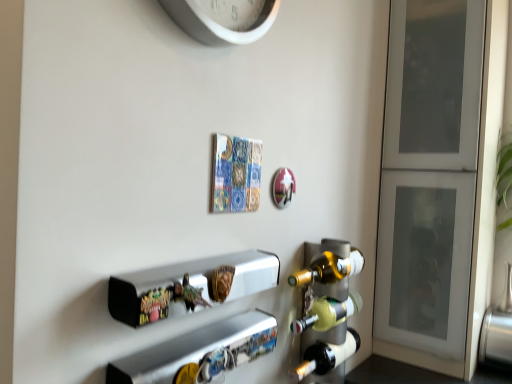
Question: Is metallic silver shelf at lower center, which ranks as the second shelf in top-to-bottom order, with matte glass wine rack at right?

Choices:
 (A) no
 (B) yes

Answer: (A)

Question: Can you confirm if metallic silver shelf at lower center, which ranks as the second shelf in top-to-bottom order, is positioned to the left of matte glass wine rack at right?

Choices:
 (A) no
 (B) yes

Answer: (B)

Question: From the image's perspective, does metallic silver shelf at lower center, which ranks as the second shelf in top-to-bottom order, appear lower than matte glass wine rack at right?

Choices:
 (A) yes
 (B) no

Answer: (B)

Question: Does metallic silver shelf at lower center, which ranks as the second shelf in top-to-bottom order, have a smaller size compared to matte glass wine rack at right?

Choices:
 (A) yes
 (B) no

Answer: (A)

Question: Does metallic silver shelf at lower center, acting as the 1th shelf starting from the bottom, have a larger size compared to matte glass wine rack at right?

Choices:
 (A) yes
 (B) no

Answer: (B)

Question: From a real-world perspective, is translucent glass beer bottle at lower right physically located above or below white plastic clock at upper center?

Choices:
 (A) below
 (B) above

Answer: (A)

Question: In the image, is translucent glass beer bottle at lower right positioned in front of or behind white plastic clock at upper center?

Choices:
 (A) front
 (B) behind

Answer: (B)

Question: Looking at their shapes, would you say translucent glass beer bottle at lower right is wider or thinner than white plastic clock at upper center?

Choices:
 (A) wide
 (B) thin

Answer: (A)

Question: From the image's perspective, is translucent glass beer bottle at lower right located above or below white plastic clock at upper center?

Choices:
 (A) above
 (B) below

Answer: (B)

Question: From a real-world perspective, is white frosted glass cabinet at right physically located above or below white plastic clock at upper center?

Choices:
 (A) below
 (B) above

Answer: (A)

Question: From their relative heights in the image, would you say white frosted glass cabinet at right is taller or shorter than white plastic clock at upper center?

Choices:
 (A) short
 (B) tall

Answer: (B)

Question: In terms of width, does white frosted glass cabinet at right look wider or thinner when compared to white plastic clock at upper center?

Choices:
 (A) thin
 (B) wide

Answer: (B)

Question: Based on their sizes in the image, would you say white frosted glass cabinet at right is bigger or smaller than white plastic clock at upper center?

Choices:
 (A) big
 (B) small

Answer: (A)

Question: Considering their positions, is white frosted glass cabinet at right located in front of or behind matte glass wine rack at right?

Choices:
 (A) behind
 (B) front

Answer: (A)

Question: Considering the positions of white frosted glass cabinet at right and matte glass wine rack at right in the image, is white frosted glass cabinet at right taller or shorter than matte glass wine rack at right?

Choices:
 (A) short
 (B) tall

Answer: (B)